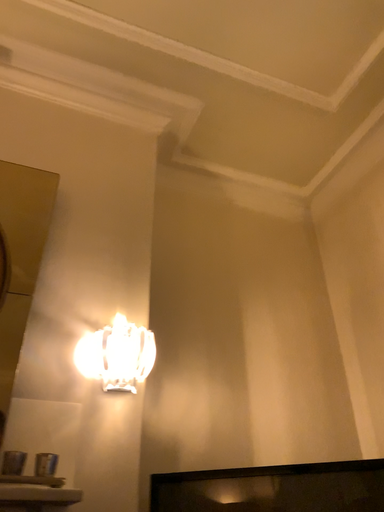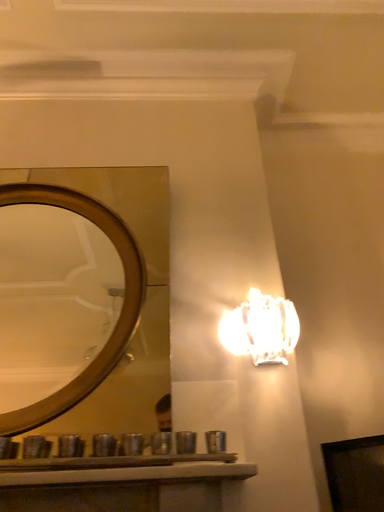
Question: How did the camera likely rotate when shooting the video?

Choices:
 (A) rotated left
 (B) rotated right

Answer: (A)